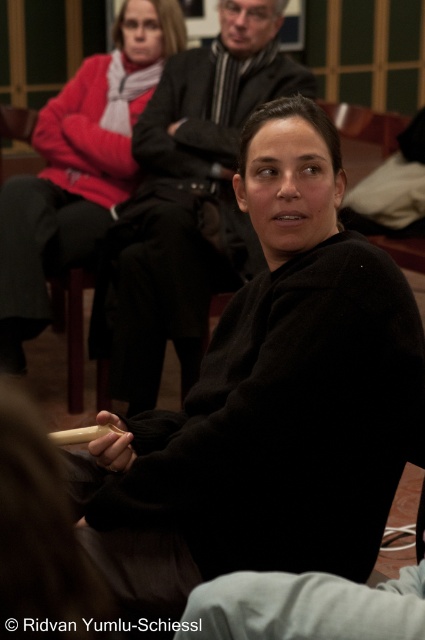
Question: Which object appears closest to the camera in this image?

Choices:
 (A) dark woolen sweater at center
 (B) black matte sweater at center
 (C) matte black sweater at upper left

Answer: (B)

Question: Is black matte sweater at center above matte black sweater at upper left?

Choices:
 (A) yes
 (B) no

Answer: (B)

Question: Considering the real-world distances, which object is farthest from the dark woolen sweater at center?

Choices:
 (A) matte black sweater at upper left
 (B) black matte sweater at center

Answer: (B)

Question: From the image, what is the correct spatial relationship of black matte sweater at center in relation to dark woolen sweater at center?

Choices:
 (A) left
 (B) right

Answer: (B)

Question: Considering the real-world distances, which object is closest to the matte black sweater at upper left?

Choices:
 (A) dark woolen sweater at center
 (B) black matte sweater at center

Answer: (A)

Question: Is black matte sweater at center further to the viewer compared to matte black sweater at upper left?

Choices:
 (A) yes
 (B) no

Answer: (B)